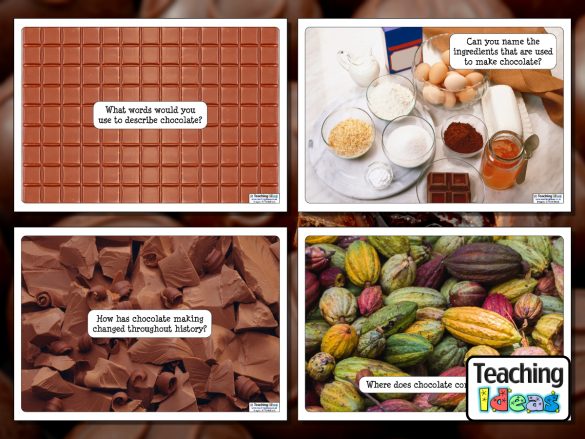
At what (x,y) coordinates should I click in order to perform the action: click on bowl of eggs. Please return your answer as a coordinate pair (x, y). Looking at the image, I should click on (439, 74).